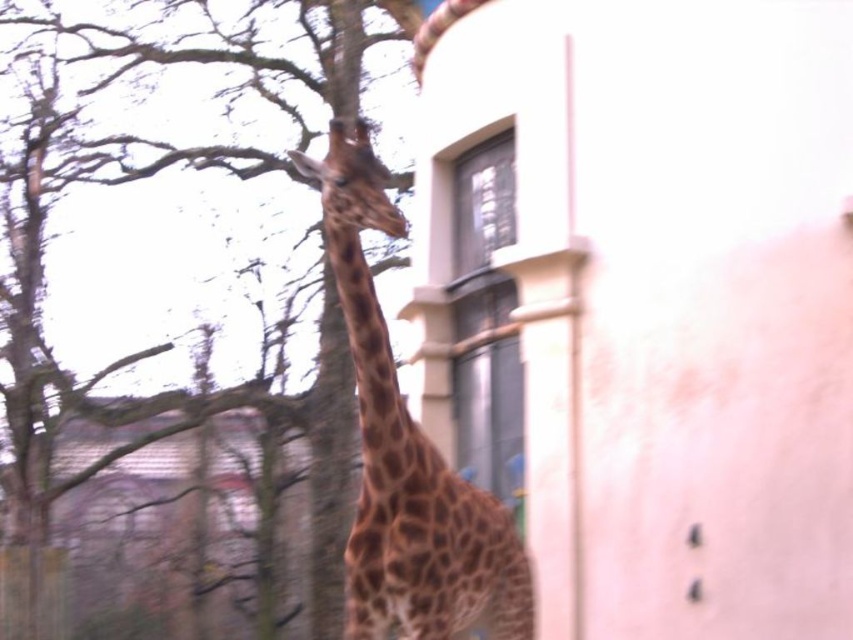
You are a photographer trying to capture a wide shot of both the brown textured tree at upper left and the brown spotted giraffe at center. Based on their sizes, which object would require more space in the frame to avoid cropping?

The brown textured tree at upper left requires more space in the frame because its width is larger than the brown spotted giraffe at center.

You are a bird flying above the scene. You see the brown textured tree at upper left and the brown spotted giraffe at center. Which object would appear larger in your field of view?

The brown textured tree at upper left would appear larger in your field of view because it is bigger than the brown spotted giraffe at center according to the description.